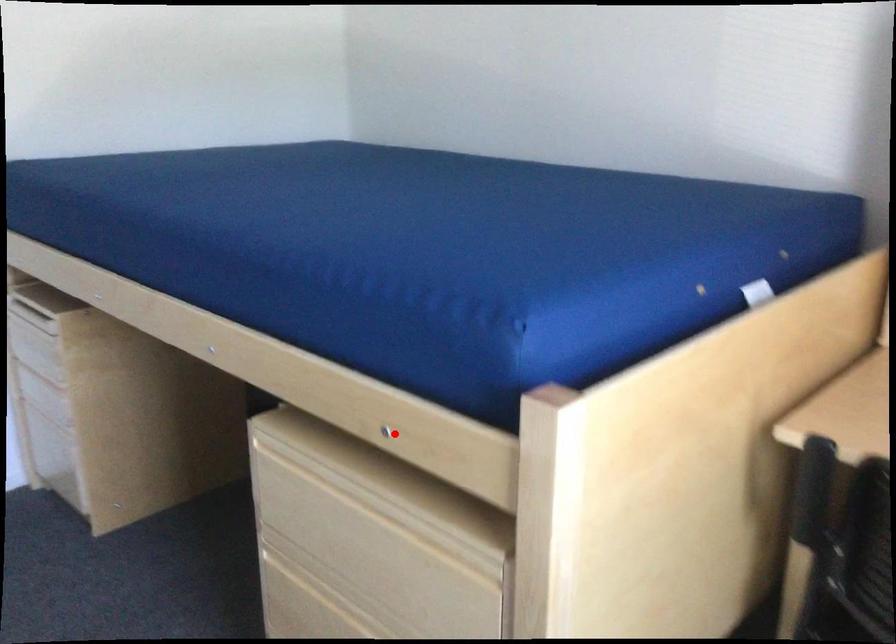
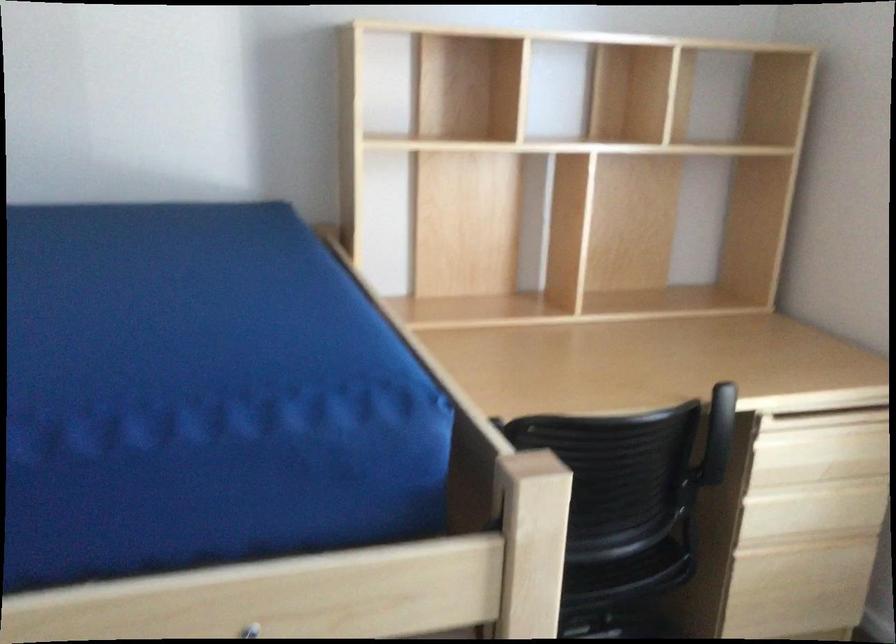
Question: I am providing you with two images of the same scene from different viewpoints. Image1 has a red point marked. In image2, the corresponding 3D location appears at what relative position? Reply with the corresponding letter.

Choices:
 (A) Closer
 (B) Farther

Answer: (A)